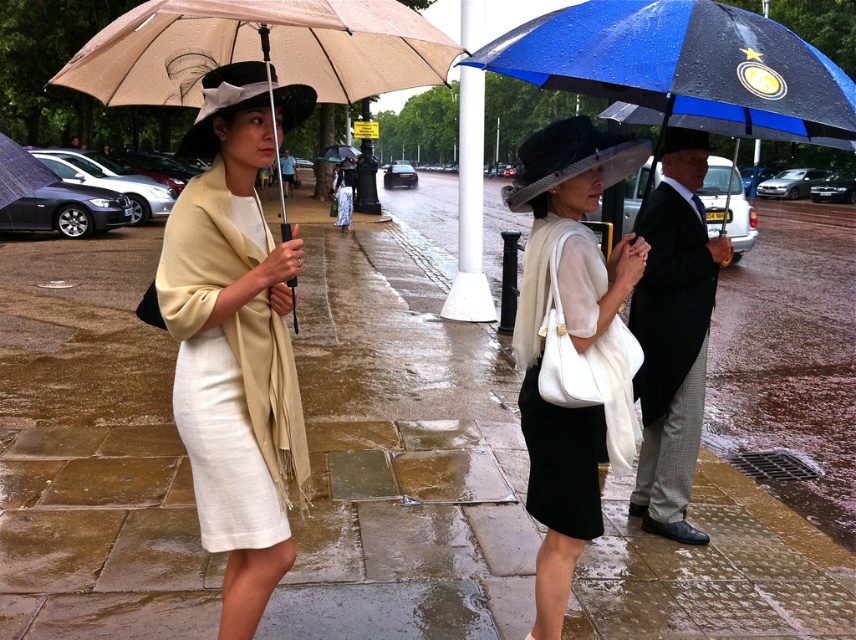
You are standing on the wet stone pavement at center and want to reach the beige fabric umbrella at left. Which direction should you move to get there?

The beige fabric umbrella at left is to the left of the wet stone pavement at center, so you should move to the left to reach it.